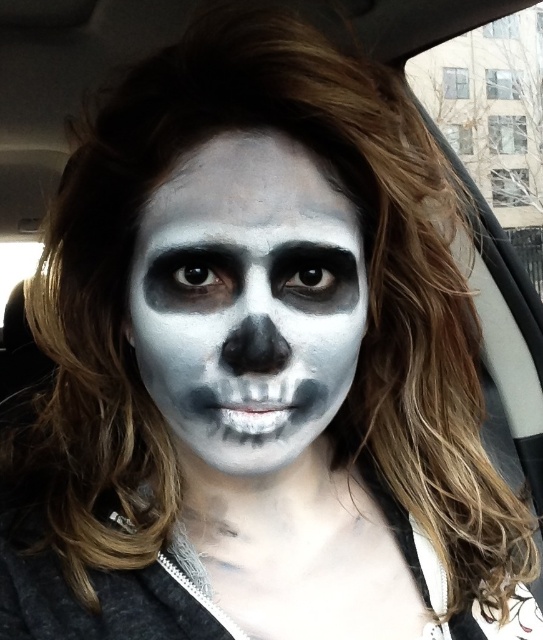
Question: Does white matte skull makeup at center appear under white matte skeleton face paint at center?

Choices:
 (A) no
 (B) yes

Answer: (A)

Question: Can you confirm if white matte skull makeup at center is positioned above white matte skeleton face paint at center?

Choices:
 (A) no
 (B) yes

Answer: (B)

Question: Which point is closer to the camera taking this photo?

Choices:
 (A) (116, 580)
 (B) (326, 172)

Answer: (B)

Question: Where is white matte skull makeup at center located in relation to white matte skeleton face paint at center in the image?

Choices:
 (A) right
 (B) left

Answer: (B)

Question: Which point is farther to the camera?

Choices:
 (A) (233, 253)
 (B) (15, 547)

Answer: (B)